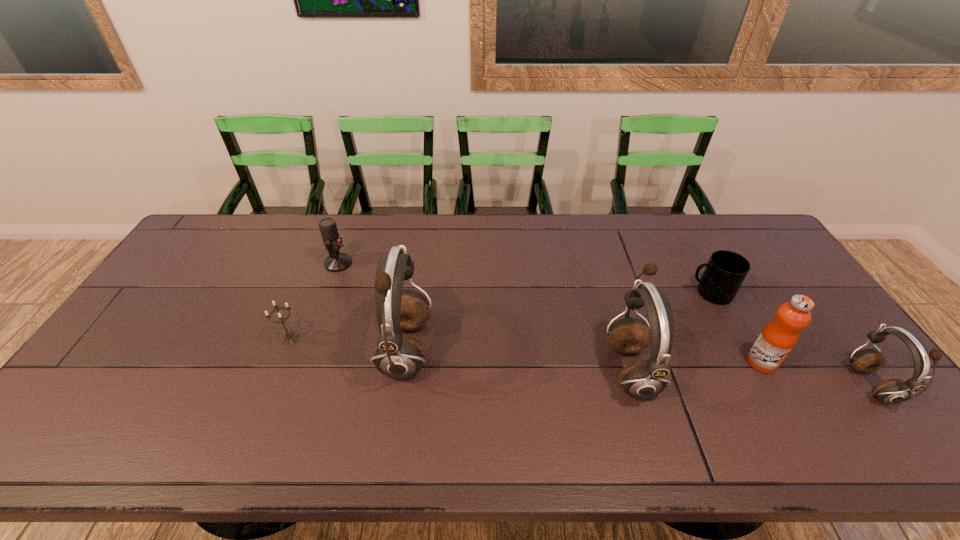
Observe the arrangement of all earphones in the image. To keep them evenly spaced, where would you place another earphone on the left? Please locate a free space. Please provide its 2D coordinates. Your answer should be formatted as a tuple, i.e. [(x, y)], where the tuple contains the x and y coordinates of a point satisfying the conditions above.

[(196, 334)]